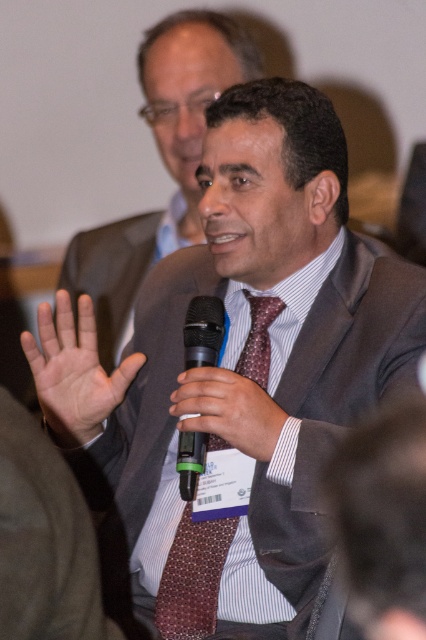
You are designing a protective case for the black matte microphone at center. The case must fit snugly around it. Given that the smooth skin hand at center is already holding the microphone, can you determine if the case will also accommodate the hand when closed?

The smooth skin hand at center is wider than the black matte microphone at center, so the case designed to fit snugly around the microphone would not accommodate the hand when closed since the hand is larger in width.

You are a photographer at a conference trying to capture a clear shot of both the smooth skin hand at center and the black matte microphone at center. Since you want both objects in focus, which one should you adjust your camera focus closer to?

The smooth skin hand at center is further to the viewer than the black matte microphone at center, so you should adjust your camera focus closer to the smooth skin hand at center to ensure both are in focus.

You are an event photographer at the conference. You need to capture a clear photo of both the maroon textured tie at center and the black plastic microphone at center. Which object should you focus on first to ensure both are in focus?

The maroon textured tie at center is closer to the viewer than the black plastic microphone at center. To ensure both are in focus, you should focus on the maroon textured tie at center first, as it is closer, and then adjust slightly for the black plastic microphone at center.